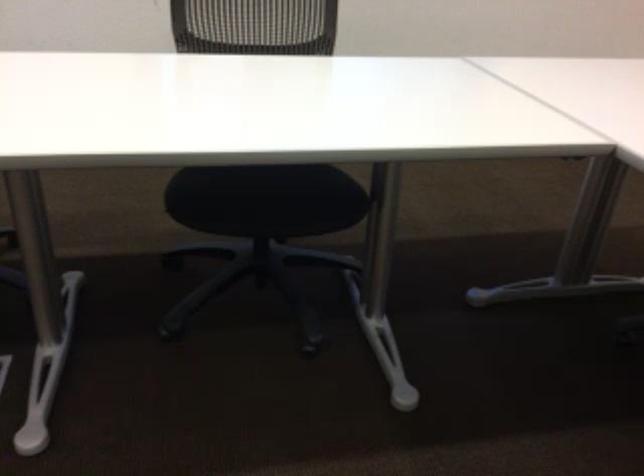
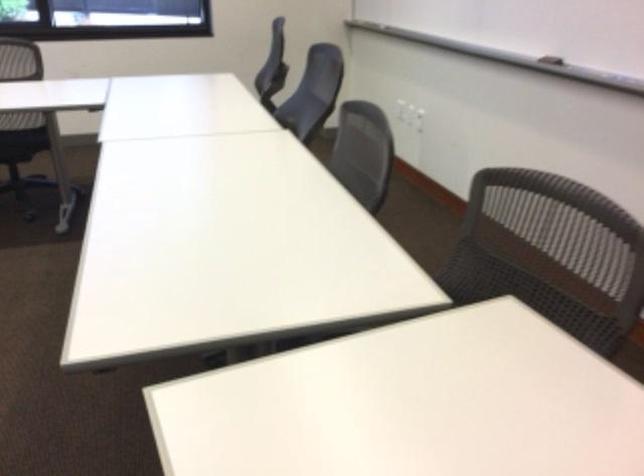
Which direction would the cameraman need to move to produce the second image?

The movement direction of the cameraman is right, backward.